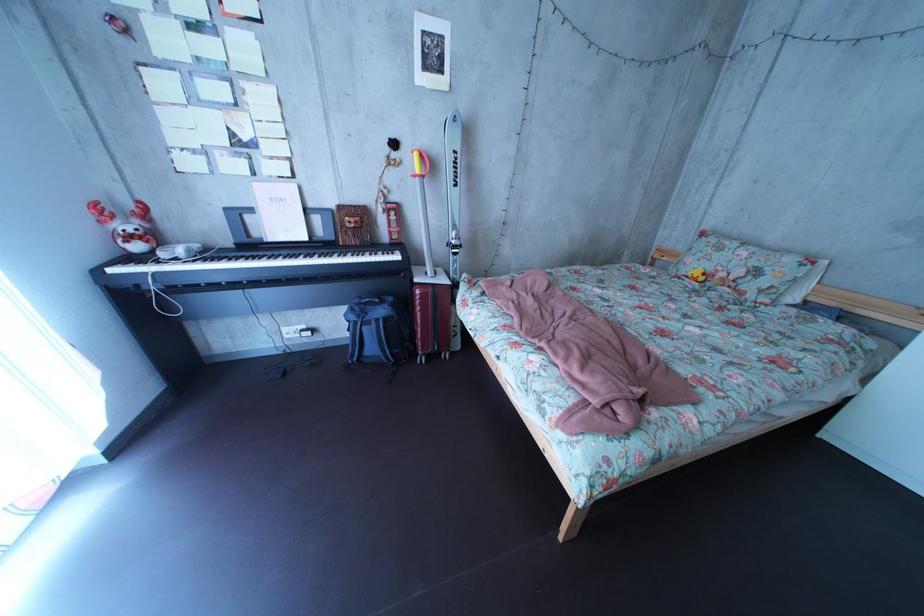
The width and height of the screenshot is (924, 616). What do you see at coordinates (378, 331) in the screenshot? I see `a backpack top handle` at bounding box center [378, 331].